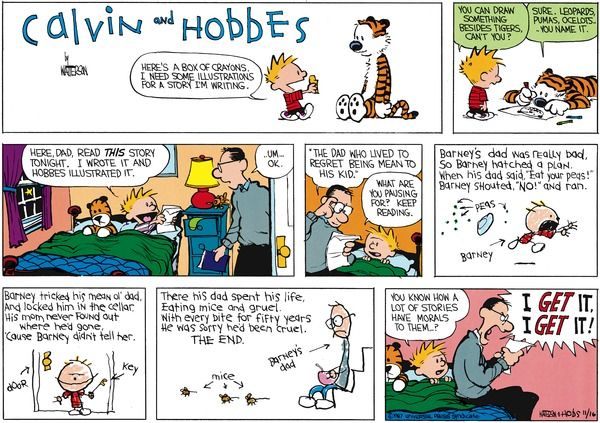
Where is `panels`? This screenshot has height=423, width=600. panels is located at coordinates (411, 76), (510, 125), (496, 179), (373, 202), (262, 208), (121, 315), (222, 325), (471, 331).